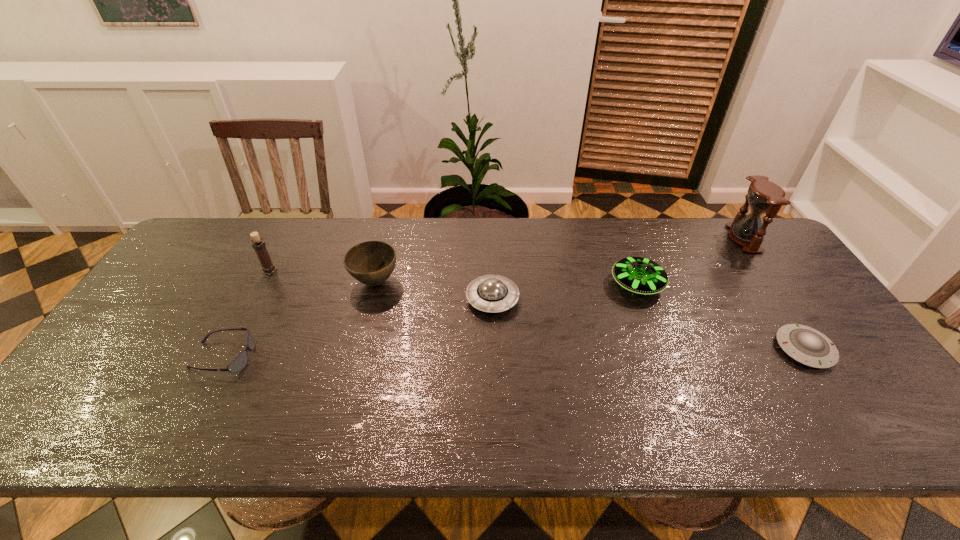
This screenshot has width=960, height=540. What are the coordinates of `hourglass at the right edge` in the screenshot? It's located at (764, 196).

At what (x,y) coordinates should I click in order to perform the action: click on saucer at the right edge. Please return your answer as a coordinate pair (x, y). The image size is (960, 540). Looking at the image, I should click on point(804,344).

This screenshot has height=540, width=960. What are the coordinates of `object located in the far right corner section of the desktop` in the screenshot? It's located at (764, 196).

Locate an element on the screen. The image size is (960, 540). vacant space at the far edge is located at coordinates (606, 253).

Image resolution: width=960 pixels, height=540 pixels. I want to click on vacant area at the near edge, so click(505, 414).

The width and height of the screenshot is (960, 540). I want to click on vacant space at the left edge of the desktop, so click(x=202, y=303).

Identify the location of blank space at the right edge. (773, 271).

Find the location of `blank space at the far left corner`. blank space at the far left corner is located at coordinates click(x=238, y=245).

Identify the location of free space at the far right corner of the desktop. (741, 247).

The height and width of the screenshot is (540, 960). Identify the location of vacant space that's between the fourth tallest object and the second shortest object. (430, 321).